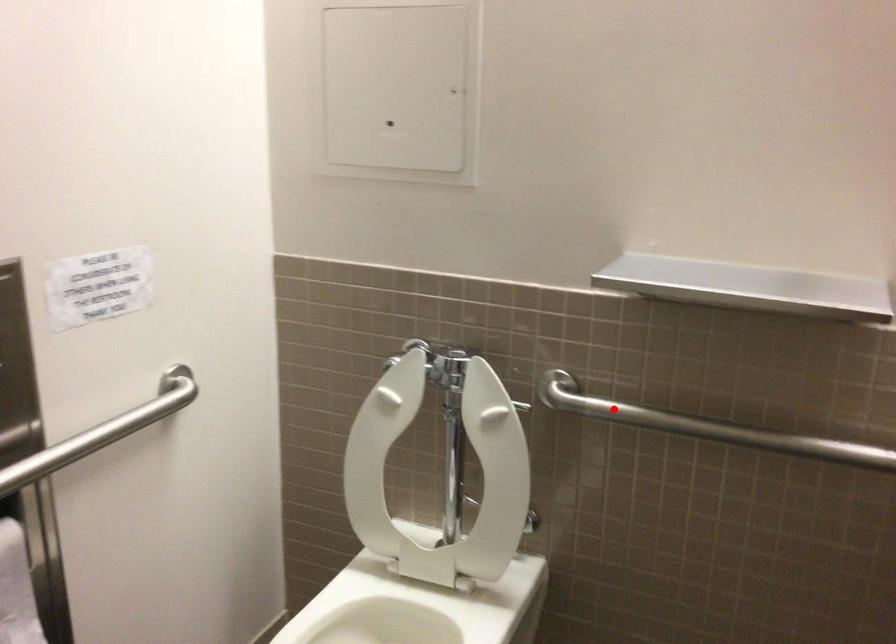
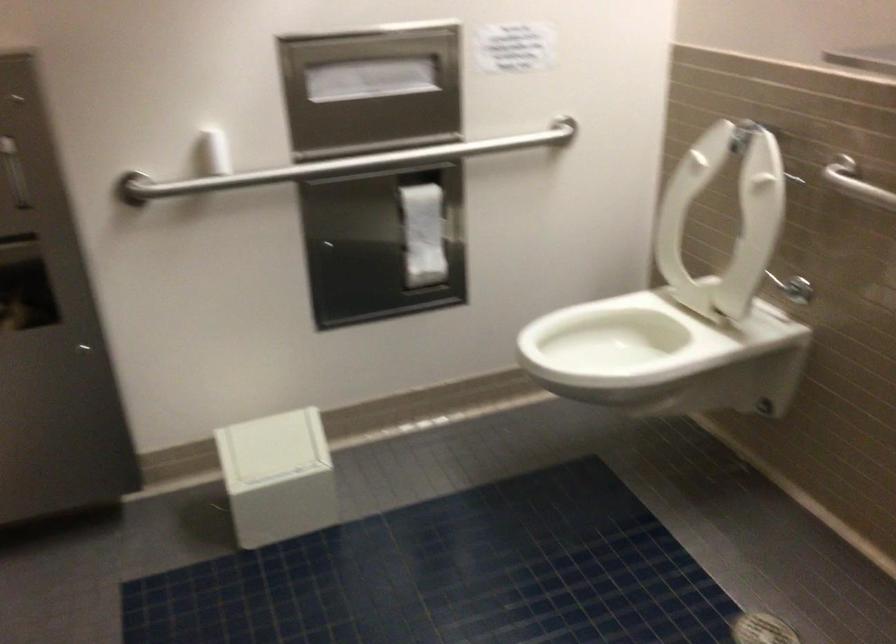
Locate, in the second image, the point that corresponds to the highlighted location in the first image.

(856, 183)